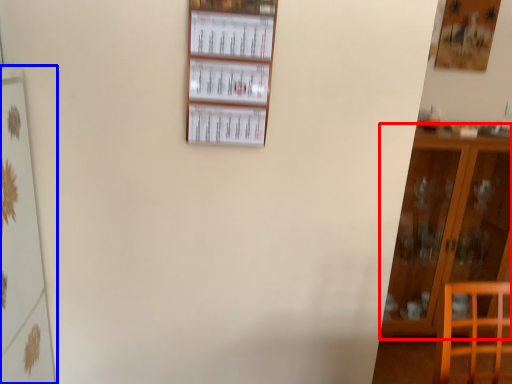
Question: Which point is further to the camera, furniture (highlighted by a red box) or shelf (highlighted by a blue box)?

Choices:
 (A) furniture
 (B) shelf

Answer: (A)